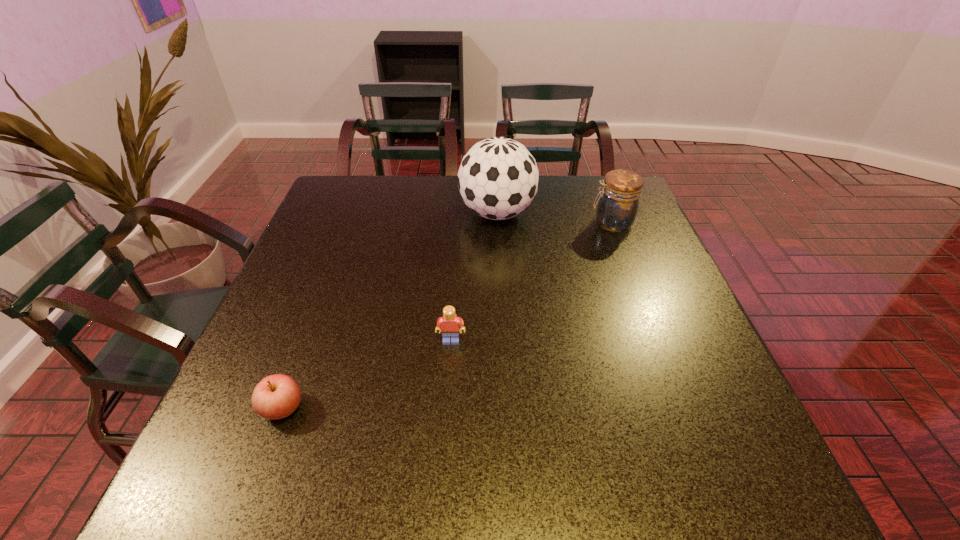
Identify the location of free space located on the lid of the jar. (542, 223).

Identify the location of free space located on the front-facing side of the Lego. (444, 465).

Locate an element on the screen. The width and height of the screenshot is (960, 540). free space located on the right of the apple is located at coordinates (401, 408).

What are the coordinates of `soccer ball at the far edge` in the screenshot? It's located at (498, 177).

You are a GUI agent. You are given a task and a screenshot of the screen. Output one action in this format:
    pyautogui.click(x=<x>, y=<y>)
    Task: Click on the jar that is at the far edge
    The width and height of the screenshot is (960, 540).
    Given the screenshot: What is the action you would take?
    pos(618,204)

Where is `object positioned at the left edge`? object positioned at the left edge is located at coordinates (277, 396).

At what (x,y) coordinates should I click in order to perform the action: click on object that is at the right edge. Please return your answer as a coordinate pair (x, y). This screenshot has width=960, height=540. Looking at the image, I should click on click(618, 204).

Image resolution: width=960 pixels, height=540 pixels. In order to click on object at the far right corner in this screenshot , I will do `click(618, 204)`.

Identify the location of vacant region at the far edge of the desktop. (420, 187).

In the image, there is a desktop. Where is `vacant space at the near edge`? vacant space at the near edge is located at coordinates (377, 501).